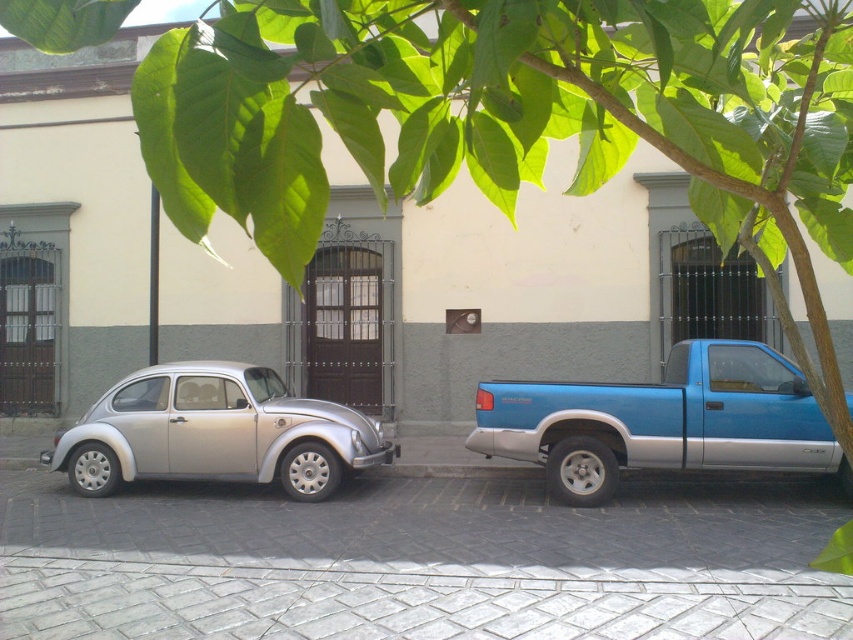
Question: Does blue metallic pickup truck at right appear on the right side of silver metallic car at left?

Choices:
 (A) no
 (B) yes

Answer: (B)

Question: Which point appears farthest from the camera in this image?

Choices:
 (A) (582, 456)
 (B) (294, 422)

Answer: (B)

Question: Does blue metallic pickup truck at right appear over silver metallic car at left?

Choices:
 (A) no
 (B) yes

Answer: (B)

Question: Among these points, which one is farthest from the camera?

Choices:
 (A) [311, 468]
 (B) [759, 362]

Answer: (A)

Question: Does blue metallic pickup truck at right have a larger size compared to silver metallic car at left?

Choices:
 (A) yes
 (B) no

Answer: (A)